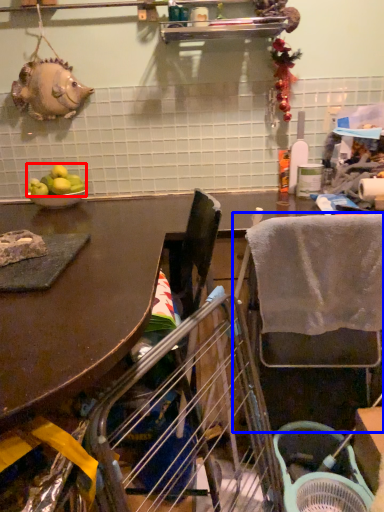
Question: Which of the following is the closest to the observer, fruit (highlighted by a red box) or chair (highlighted by a blue box)?

Choices:
 (A) fruit
 (B) chair

Answer: (B)